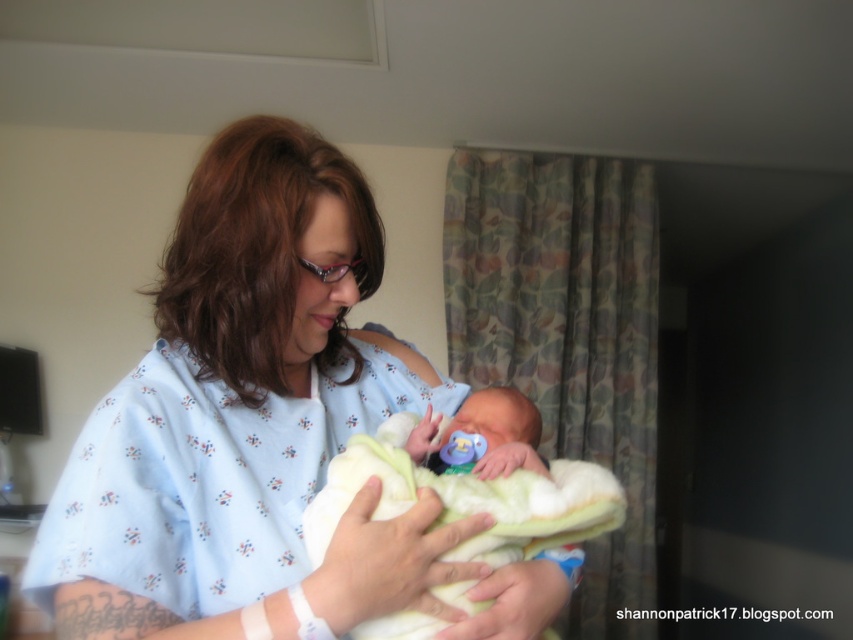
Question: Can you confirm if white soft blanket at center is positioned to the left of smooth white blanket at center?

Choices:
 (A) no
 (B) yes

Answer: (A)

Question: Which object appears farthest from the camera in this image?

Choices:
 (A) white soft blanket at center
 (B) smooth white blanket at center

Answer: (B)

Question: Is white soft blanket at center behind smooth white blanket at center?

Choices:
 (A) no
 (B) yes

Answer: (A)

Question: Is white soft blanket at center below smooth white blanket at center?

Choices:
 (A) no
 (B) yes

Answer: (B)

Question: Which of the following is the farthest from the observer?

Choices:
 (A) white soft blanket at center
 (B) smooth white blanket at center
 (C) blue floral hospital gown at center

Answer: (B)

Question: Which point appears closest to the camera in this image?

Choices:
 (A) (416, 531)
 (B) (503, 452)
 (C) (564, 560)

Answer: (A)